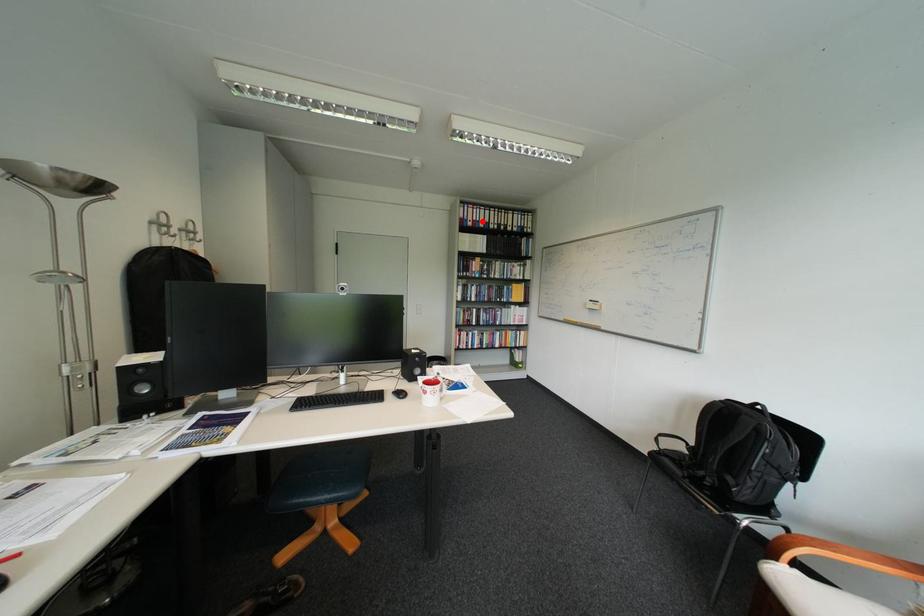
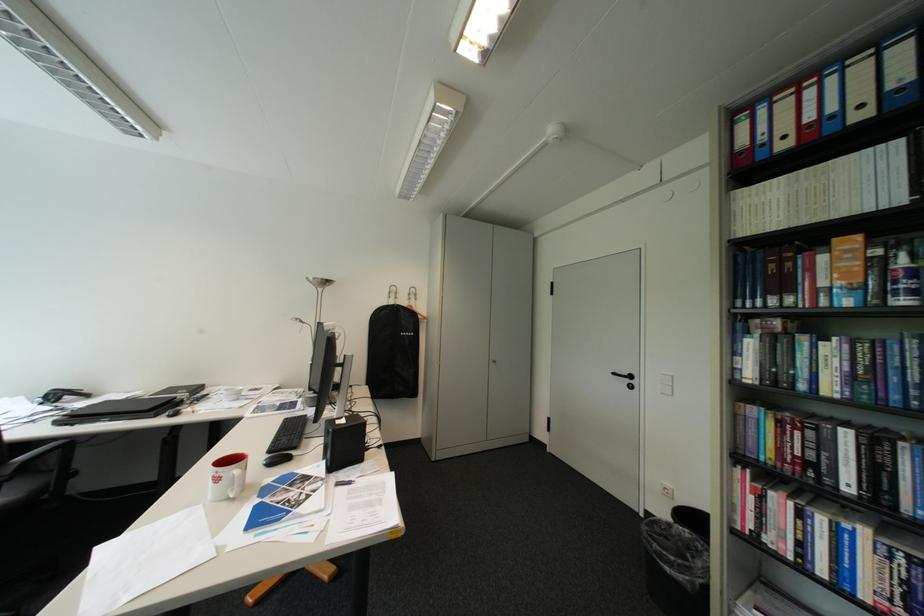
The point at the highlighted location is marked in the first image. Where is the corresponding point in the second image?

(796, 138)